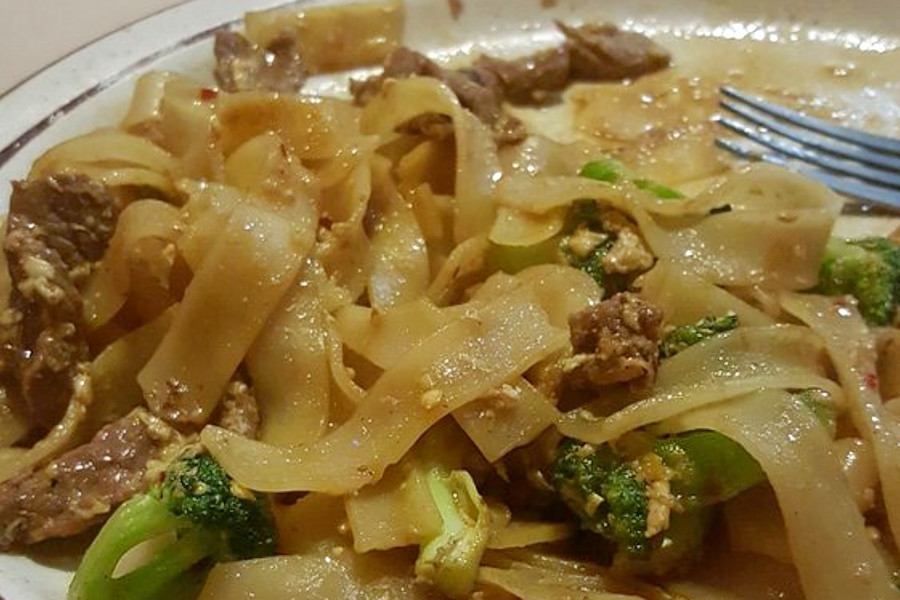
I want to click on silver fork, so click(x=896, y=204).